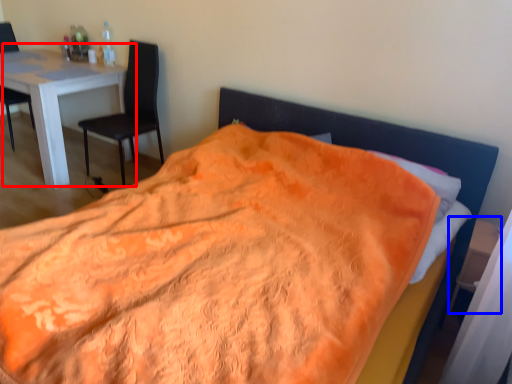
Question: Among these objects, which one is farthest to the camera, table (highlighted by a red box) or side table (highlighted by a blue box)?

Choices:
 (A) table
 (B) side table

Answer: (A)